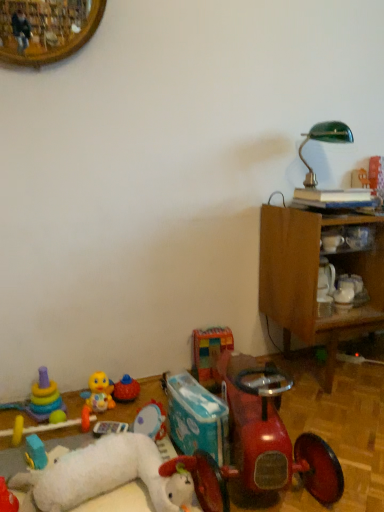
Find the location of a particular element. The width and height of the screenshot is (384, 512). unoccupied region to the right of stacked plastic rings at lower left, which appears as the 2th toy when viewed from the left is located at coordinates (84, 412).